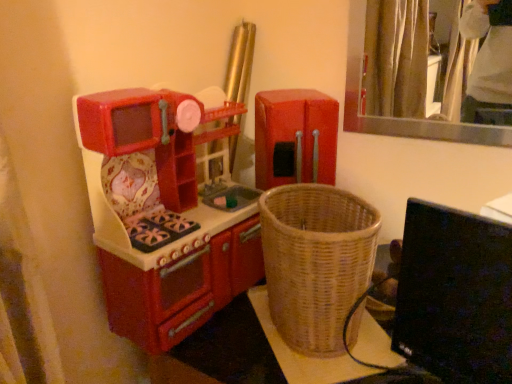
The width and height of the screenshot is (512, 384). What do you see at coordinates (316, 262) in the screenshot?
I see `woven brown basket at center` at bounding box center [316, 262].

Describe the element at coordinates (455, 295) in the screenshot. I see `black glossy computer monitor at lower right` at that location.

At what (x,y) coordinates should I click in order to perform the action: click on matte plastic toy kitchen at left, the first appliance when ordered from left to right. Please return your answer as a coordinate pair (x, y). The height and width of the screenshot is (384, 512). Looking at the image, I should click on (163, 213).

Locate an element on the screen. This screenshot has width=512, height=384. woven wicker basket at lower right is located at coordinates (301, 354).

Does point (252, 272) come behind point (354, 374)?

That is True.

How much distance is there between matte plastic toy kitchen at left, which ranks as the second appliance in right-to-left order, and woven wicker basket at lower right?

matte plastic toy kitchen at left, which ranks as the second appliance in right-to-left order, and woven wicker basket at lower right are 10.67 inches apart from each other.

In the scene shown: Do you think matte plastic toy kitchen at left, the first appliance when ordered from left to right, is within woven wicker basket at lower right, or outside of it?

matte plastic toy kitchen at left, the first appliance when ordered from left to right, is not inside woven wicker basket at lower right, it's outside.

From a real-world perspective, does red plastic refrigerator at center, the second appliance in the left-to-right sequence, stand above matte plastic toy kitchen at left, the first appliance when ordered from left to right?

Yes, from a real-world perspective, red plastic refrigerator at center, the second appliance in the left-to-right sequence, is above matte plastic toy kitchen at left, the first appliance when ordered from left to right.

How far apart are red plastic refrigerator at center, the second appliance in the left-to-right sequence, and matte plastic toy kitchen at left, the first appliance when ordered from left to right?

10.04 inches.

Is red plastic refrigerator at center, the second appliance in the left-to-right sequence, taller or shorter than matte plastic toy kitchen at left, which ranks as the second appliance in right-to-left order?

Considering their sizes, red plastic refrigerator at center, the second appliance in the left-to-right sequence, has less height than matte plastic toy kitchen at left, which ranks as the second appliance in right-to-left order.

From the image's perspective, which object appears higher, red plastic refrigerator at center, the second appliance in the left-to-right sequence, or matte plastic toy kitchen at left, which ranks as the second appliance in right-to-left order?

red plastic refrigerator at center, the second appliance in the left-to-right sequence.

Is black glossy computer monitor at lower right completely or partially inside woven brown basket at center?

Actually, black glossy computer monitor at lower right is outside woven brown basket at center.

Is woven brown basket at center wider than black glossy computer monitor at lower right?

Yes.

From a real-world perspective, is woven brown basket at center above or below black glossy computer monitor at lower right?

woven brown basket at center is situated lower than black glossy computer monitor at lower right in the real world.

How different are the orientations of woven brown basket at center and black glossy computer monitor at lower right in degrees?

The angle between the facing direction of woven brown basket at center and the facing direction of black glossy computer monitor at lower right is 12.9 degrees.

Can you see woven wicker basket at lower right touching red plastic refrigerator at center, which ranks as the 1th appliance in right-to-left order?

No, woven wicker basket at lower right is not making contact with red plastic refrigerator at center, which ranks as the 1th appliance in right-to-left order.

How distant is woven wicker basket at lower right from red plastic refrigerator at center, which ranks as the 1th appliance in right-to-left order?

woven wicker basket at lower right is 13.65 inches away from red plastic refrigerator at center, which ranks as the 1th appliance in right-to-left order.

Where is `appliance behind the woven wicker basket at lower right`? This screenshot has width=512, height=384. appliance behind the woven wicker basket at lower right is located at coordinates (295, 137).

Where is `furniture below the black glossy computer monitor at lower right (from a real-world perspective)`? The width and height of the screenshot is (512, 384). furniture below the black glossy computer monitor at lower right (from a real-world perspective) is located at coordinates (301, 354).

Considering the points (463, 225) and (367, 323), which point is in front, point (463, 225) or point (367, 323)?

Point (463, 225)

Relative to woven wicker basket at lower right, is black glossy computer monitor at lower right in front or behind?

In the image, black glossy computer monitor at lower right appears in front of woven wicker basket at lower right.

Does black glossy computer monitor at lower right contain woven wicker basket at lower right?

Actually, woven wicker basket at lower right is outside black glossy computer monitor at lower right.

From a real-world perspective, is woven brown basket at center located beneath matte plastic toy kitchen at left, the first appliance when ordered from left to right?

Indeed, from a real-world perspective, woven brown basket at center is positioned beneath matte plastic toy kitchen at left, the first appliance when ordered from left to right.

Who is smaller, woven brown basket at center or matte plastic toy kitchen at left, the first appliance when ordered from left to right?

With smaller size is woven brown basket at center.

From the image's perspective, is woven brown basket at center above or below matte plastic toy kitchen at left, which ranks as the second appliance in right-to-left order?

Based on their image positions, woven brown basket at center is located beneath matte plastic toy kitchen at left, which ranks as the second appliance in right-to-left order.

Which of these two, woven brown basket at center or matte plastic toy kitchen at left, the first appliance when ordered from left to right, stands shorter?

woven brown basket at center is shorter.

This screenshot has width=512, height=384. In order to click on basket lying on the right of red plastic refrigerator at center, the second appliance in the left-to-right sequence in this screenshot , I will do `click(316, 262)`.

Between point (295, 194) and point (298, 116), which one is positioned behind?

Positioned behind is point (298, 116).

Between woven brown basket at center and red plastic refrigerator at center, which ranks as the 1th appliance in right-to-left order, which one is positioned behind?

red plastic refrigerator at center, which ranks as the 1th appliance in right-to-left order, is further away from the camera.

Based on their sizes in the image, would you say woven brown basket at center is bigger or smaller than red plastic refrigerator at center, which ranks as the 1th appliance in right-to-left order?

Considering their sizes, woven brown basket at center takes up more space than red plastic refrigerator at center, which ranks as the 1th appliance in right-to-left order.

This screenshot has width=512, height=384. Find the location of `furniture on the right of matte plastic toy kitchen at left, the first appliance when ordered from left to right`. furniture on the right of matte plastic toy kitchen at left, the first appliance when ordered from left to right is located at coordinates (301, 354).

Locate an element on the screen. This screenshot has height=384, width=512. appliance below the red plastic refrigerator at center, the second appliance in the left-to-right sequence (from a real-world perspective) is located at coordinates (163, 213).

From the image, which object appears to be farther from woven brown basket at center, woven wicker basket at lower right or red plastic refrigerator at center, the second appliance in the left-to-right sequence?

Based on the image, red plastic refrigerator at center, the second appliance in the left-to-right sequence, appears to be further to woven brown basket at center.

Based on the photo, which object lies nearer to the anchor point woven brown basket at center, matte plastic toy kitchen at left, the first appliance when ordered from left to right, or woven wicker basket at lower right?

The object closer to woven brown basket at center is woven wicker basket at lower right.

Which object lies further to the anchor point black glossy computer monitor at lower right, woven brown basket at center or red plastic refrigerator at center, the second appliance in the left-to-right sequence?

red plastic refrigerator at center, the second appliance in the left-to-right sequence.

Based on their spatial positions, is red plastic refrigerator at center, which ranks as the 1th appliance in right-to-left order, or matte plastic toy kitchen at left, which ranks as the second appliance in right-to-left order, closer to woven wicker basket at lower right?

Based on the image, matte plastic toy kitchen at left, which ranks as the second appliance in right-to-left order, appears to be nearer to woven wicker basket at lower right.

Based on their spatial positions, is matte plastic toy kitchen at left, the first appliance when ordered from left to right, or black glossy computer monitor at lower right closer to woven wicker basket at lower right?

Based on the image, black glossy computer monitor at lower right appears to be nearer to woven wicker basket at lower right.

From the image, which object appears to be farther from black glossy computer monitor at lower right, woven brown basket at center or matte plastic toy kitchen at left, the first appliance when ordered from left to right?

matte plastic toy kitchen at left, the first appliance when ordered from left to right, is positioned further to the anchor black glossy computer monitor at lower right.

Estimate the real-world distances between objects in this image. Which object is further from woven brown basket at center, woven wicker basket at lower right or matte plastic toy kitchen at left, the first appliance when ordered from left to right?

matte plastic toy kitchen at left, the first appliance when ordered from left to right, lies further to woven brown basket at center than the other object.

Estimate the real-world distances between objects in this image. Which object is further from matte plastic toy kitchen at left, which ranks as the second appliance in right-to-left order, woven brown basket at center or woven wicker basket at lower right?

Among the two, woven wicker basket at lower right is located further to matte plastic toy kitchen at left, which ranks as the second appliance in right-to-left order.

The height and width of the screenshot is (384, 512). Identify the location of furniture situated between matte plastic toy kitchen at left, the first appliance when ordered from left to right, and black glossy computer monitor at lower right from left to right. (301, 354).

Where is `basket between red plastic refrigerator at center, the second appliance in the left-to-right sequence, and woven wicker basket at lower right, in the vertical direction`? The height and width of the screenshot is (384, 512). basket between red plastic refrigerator at center, the second appliance in the left-to-right sequence, and woven wicker basket at lower right, in the vertical direction is located at coordinates (316, 262).

You are a GUI agent. You are given a task and a screenshot of the screen. Output one action in this format:
    pyautogui.click(x=<x>, y=<y>)
    Task: Click on the basket situated between matte plastic toy kitchen at left, which ranks as the second appliance in right-to-left order, and black glossy computer monitor at lower right from left to right
    The width and height of the screenshot is (512, 384).
    Given the screenshot: What is the action you would take?
    pyautogui.click(x=316, y=262)

I want to click on basket between matte plastic toy kitchen at left, the first appliance when ordered from left to right, and woven wicker basket at lower right from left to right, so click(x=316, y=262).